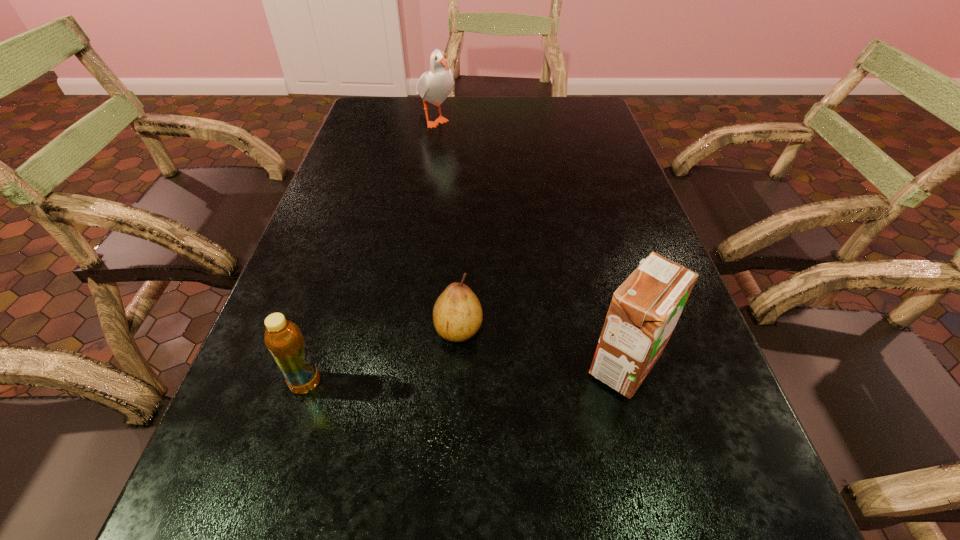
Where is `free space that satisfies the following two spatial constraints: 1. on the straw side of the rightmost object; 2. on the front side of the leftmost object`? Image resolution: width=960 pixels, height=540 pixels. free space that satisfies the following two spatial constraints: 1. on the straw side of the rightmost object; 2. on the front side of the leftmost object is located at coordinates (630, 383).

Locate an element on the screen. The width and height of the screenshot is (960, 540). free spot that satisfies the following two spatial constraints: 1. on the back side of the leftmost object; 2. on the left side of the pear is located at coordinates (324, 329).

In order to click on free space that satisfies the following two spatial constraints: 1. at the beak of the pear; 2. on the left side of the farthest object in this screenshot , I will do `click(402, 329)`.

The height and width of the screenshot is (540, 960). In order to click on vacant region that satisfies the following two spatial constraints: 1. on the straw side of the rightmost object; 2. on the front side of the leftmost object in this screenshot , I will do `click(630, 383)`.